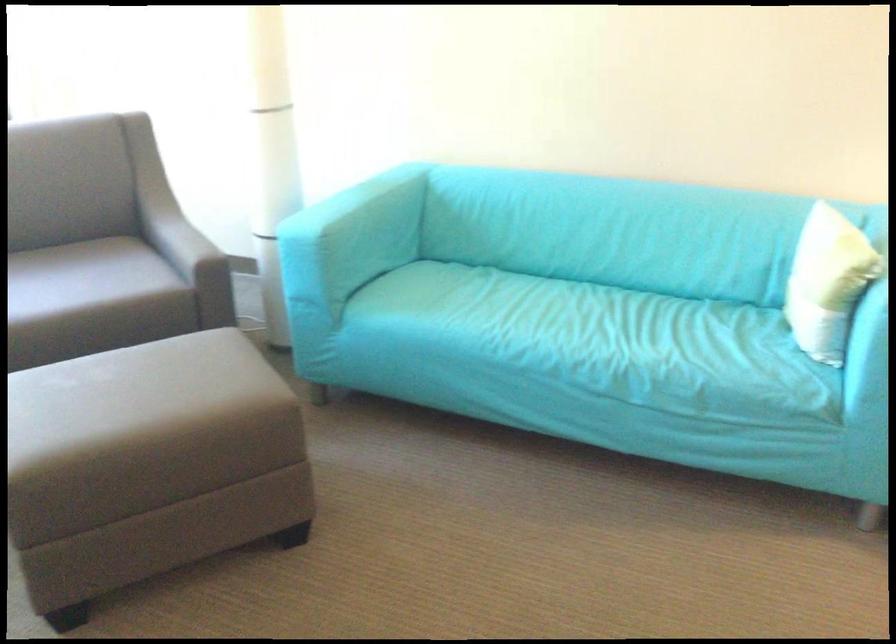
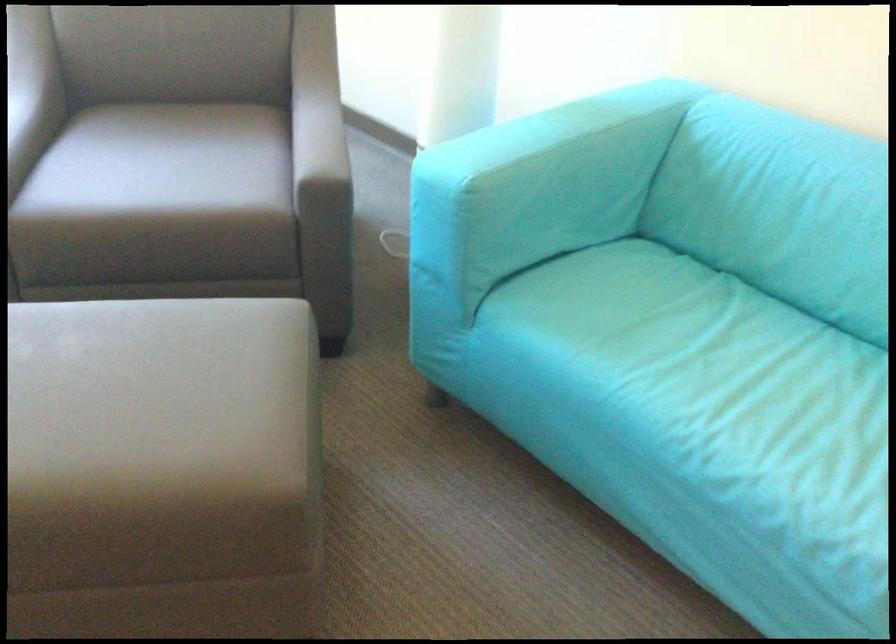
The point at (191, 413) is marked in the first image. Where is the corresponding point in the second image?

(162, 469)